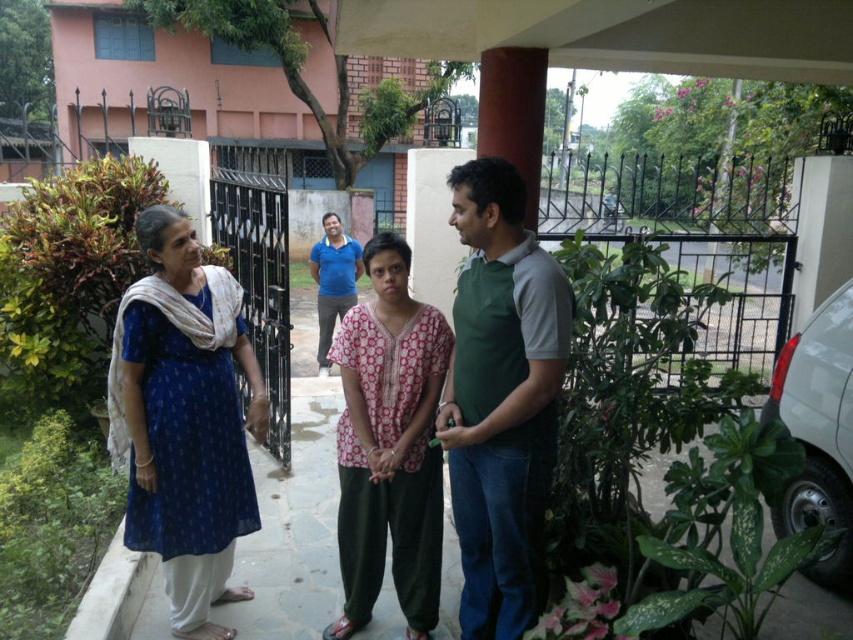
Is blue printed dress at left thinner than blue cotton kurta at left?

No.

Between point (358, 486) and point (160, 237), which one is positioned in front?

Point (160, 237)

This screenshot has width=853, height=640. I want to click on blue printed dress at left, so click(454, 417).

Between point (502, 410) and point (231, 438), which one is positioned in front?

Point (502, 410) is more forward.

Does green cotton shirt at center appear on the left side of blue cotton kurta at left?

Incorrect, green cotton shirt at center is not on the left side of blue cotton kurta at left.

Locate an element on the screen. Image resolution: width=853 pixels, height=640 pixels. green cotton shirt at center is located at coordinates (502, 397).

Find the location of `green cotton shirt at center`. green cotton shirt at center is located at coordinates (502, 397).

Does blue printed dress at left have a larger size compared to pink printed blouse at center?

Indeed, blue printed dress at left has a larger size compared to pink printed blouse at center.

Who is more forward, (527, 282) or (343, 512)?

Point (527, 282) is more forward.

At what (x,y) coordinates should I click in order to perform the action: click on blue printed dress at left. Please return your answer as a coordinate pair (x, y). Image resolution: width=853 pixels, height=640 pixels. Looking at the image, I should click on (454, 417).